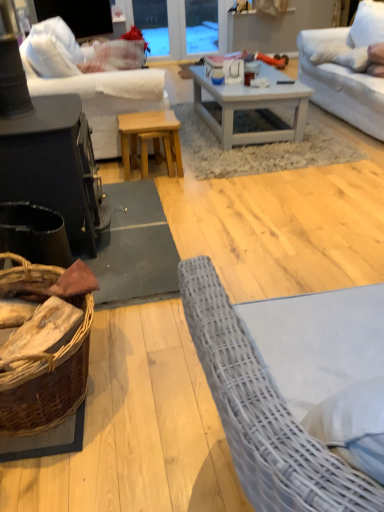
Identify the location of free point above natural wood stool at center, the second table from the front (from a real-world perspective). The image size is (384, 512). (146, 113).